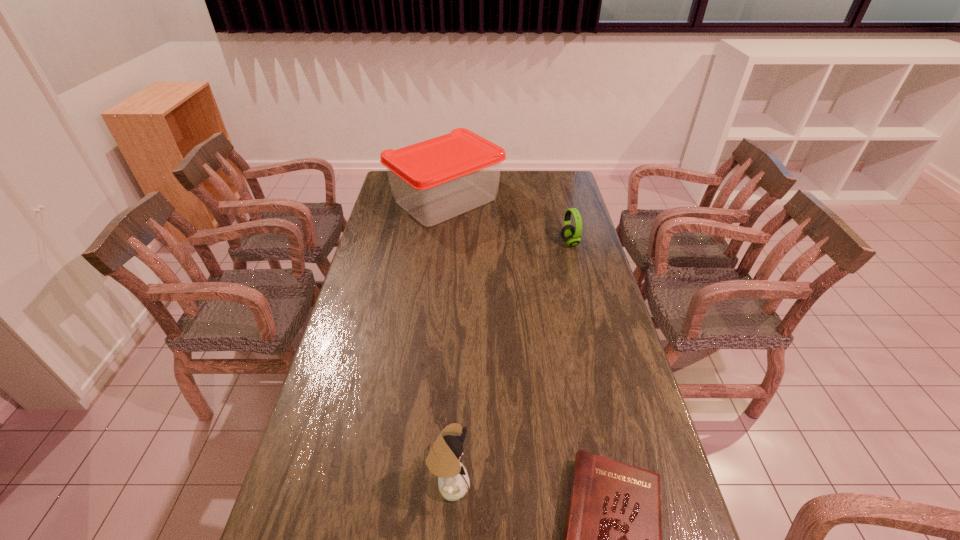
The image size is (960, 540). Find the location of `tray`. tray is located at coordinates (435, 180).

Identify the location of doll. (443, 460).

Locate an element on the screen. the second farthest object is located at coordinates (572, 235).

This screenshot has width=960, height=540. What are the coordinates of `the second shortest object` in the screenshot? It's located at (572, 235).

Find the location of a particular element. The width and height of the screenshot is (960, 540). vacant space situated on the front of the farthest object is located at coordinates (441, 246).

Where is `vacant space located 0.170m at the front face of the doll`? Image resolution: width=960 pixels, height=540 pixels. vacant space located 0.170m at the front face of the doll is located at coordinates (540, 484).

Where is `vacant point located 0.090m on the back of the headset`? The height and width of the screenshot is (540, 960). vacant point located 0.090m on the back of the headset is located at coordinates (564, 222).

This screenshot has width=960, height=540. Identify the location of object that is at the far edge. (435, 180).

Where is `object that is at the left edge`? object that is at the left edge is located at coordinates [435, 180].

Image resolution: width=960 pixels, height=540 pixels. What are the coordinates of `object positioned at the right edge` in the screenshot? It's located at (572, 235).